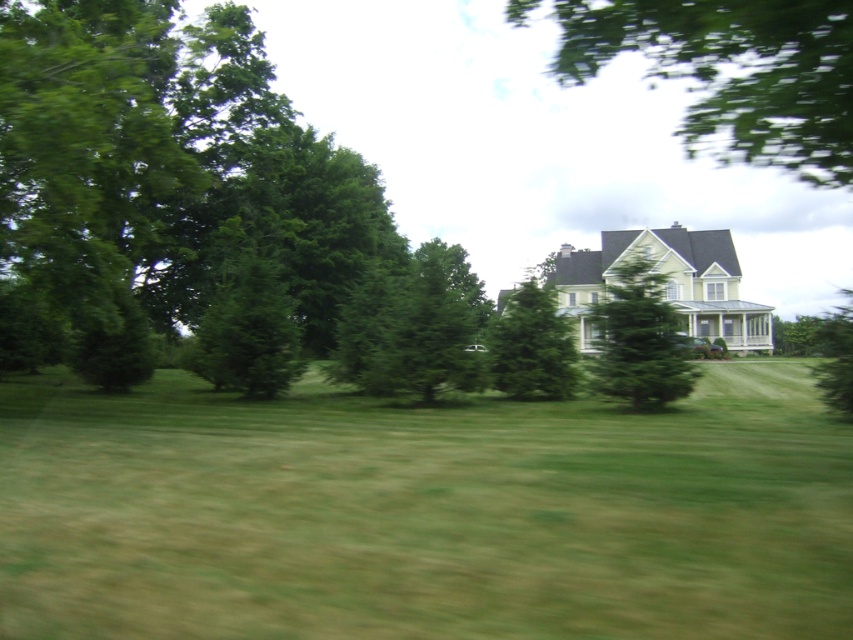
Question: Is green leafy tree at upper center smaller than green textured tree at center?

Choices:
 (A) no
 (B) yes

Answer: (A)

Question: Considering the real-world distances, which object is farthest from the green textured tree at center?

Choices:
 (A) green grass at center
 (B) green leafy tree at upper center
 (C) green textured evergreen tree at center

Answer: (B)

Question: Considering the relative positions of green grass at center and green leafy tree at upper center in the image provided, where is green grass at center located with respect to green leafy tree at upper center?

Choices:
 (A) left
 (B) right

Answer: (A)

Question: Which of the following is the farthest from the observer?

Choices:
 (A) (845, 77)
 (B) (596, 372)

Answer: (B)

Question: Which point appears closest to the camera in this image?

Choices:
 (A) (666, 349)
 (B) (525, 346)
 (C) (740, 424)

Answer: (C)

Question: Does green grass at center have a smaller size compared to green textured evergreen tree at center?

Choices:
 (A) yes
 (B) no

Answer: (A)